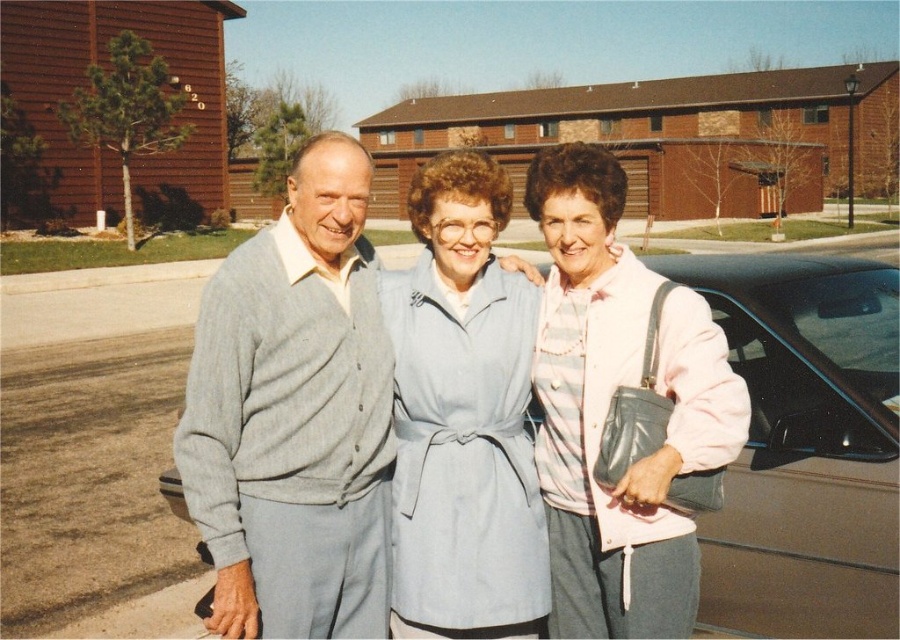
You are a delivery person trying to deliver a package to the recipient standing near the metallic gray car at center. However, you notice the pink fabric jacket at center is blocking your path. Can you still reach the recipient without moving the jacket?

The pink fabric jacket at center is behind the metallic gray car at center, so the jacket is not blocking your path. You can reach the recipient near the metallic gray car at center without moving the jacket.

You are a delivery person trying to park your van between the metallic gray car at center and the pink fabric jacket at center. Can you fit your van, which is 2 meters wide, in the space between them?

The metallic gray car at center is thinner than the pink fabric jacket at center, so the space between them is wider than the car. However, since the exact width isn not provided, it is uncertain if the van can fit. Please check the actual space.

You are a photographer trying to capture a photo of the gray cardigan at center and the metallic gray car at center. Based on their heights, which object should you focus on first to ensure it appears larger in the photo?

The gray cardigan at center has a greater height compared to the metallic gray car at center, so you should focus on the gray cardigan at center first to ensure it appears larger in the photo.